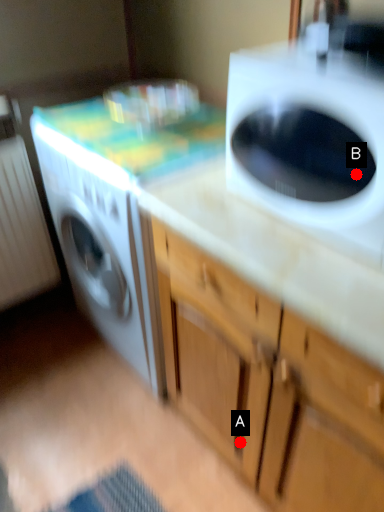
Question: Two points are circled on the image, labeled by A and B beside each circle. Which point is closer to the camera?

Choices:
 (A) A is closer
 (B) B is closer

Answer: (B)